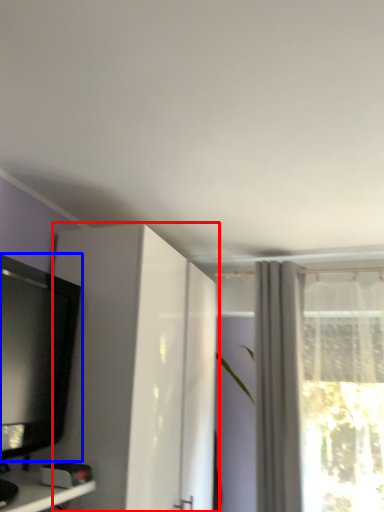
Question: Among these objects, which one is farthest to the camera, cabinetry (highlighted by a red box) or television (highlighted by a blue box)?

Choices:
 (A) cabinetry
 (B) television

Answer: (A)